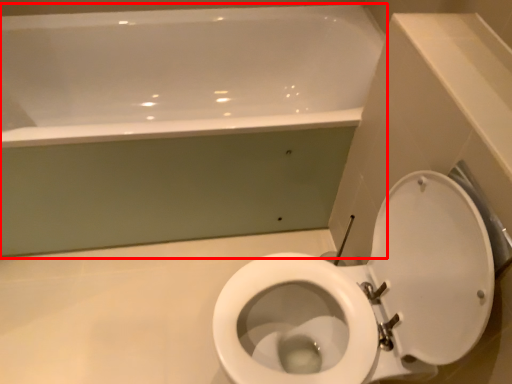
Question: From the image's perspective, what is the correct spatial positioning of bathtub (annotated by the red box) in reference to toilet?

Choices:
 (A) above
 (B) below

Answer: (A)